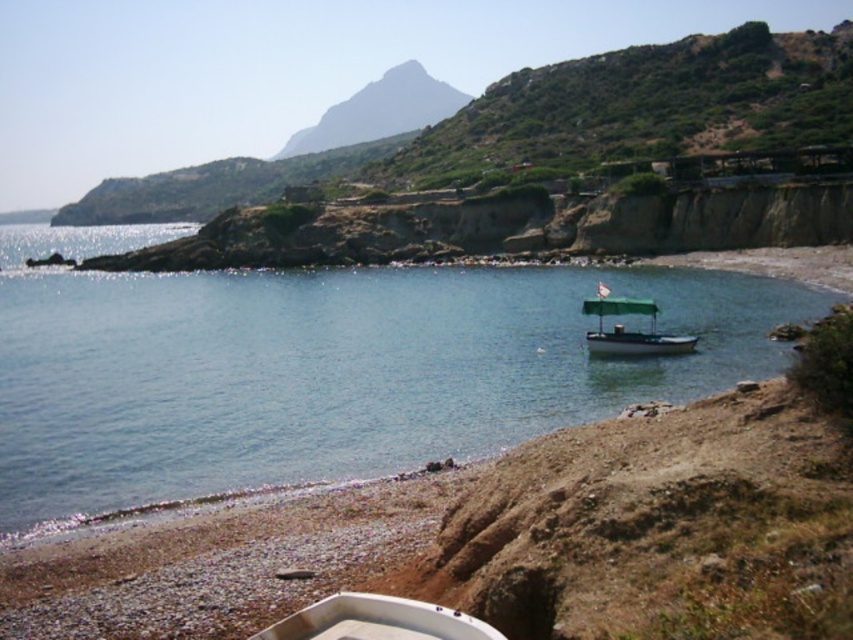
You are standing on the pebbled beach in the foreground of the coastal scene. You notice a small white plastic boat at lower center. Where exactly is the point at coordinate [376,620] located on the boat?

The point at coordinate [376,620] is located on the white plastic boat at lower center.